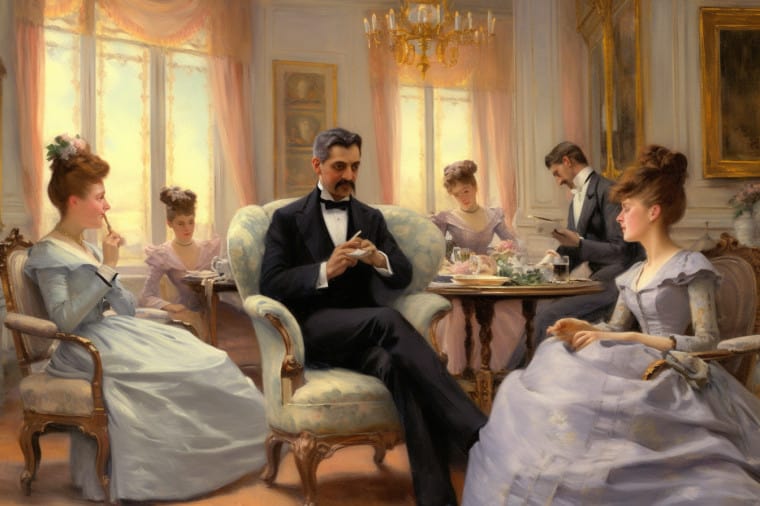
Where is `painting`? The image size is (760, 506). painting is located at coordinates (264, 92).